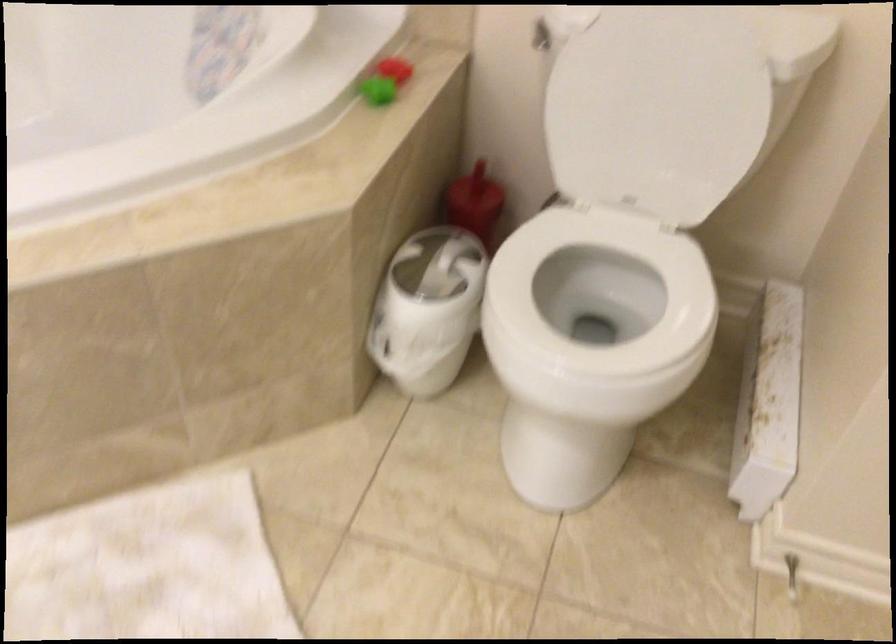
Image resolution: width=896 pixels, height=644 pixels. In order to click on white toilet seat in this screenshot , I will do `click(599, 299)`.